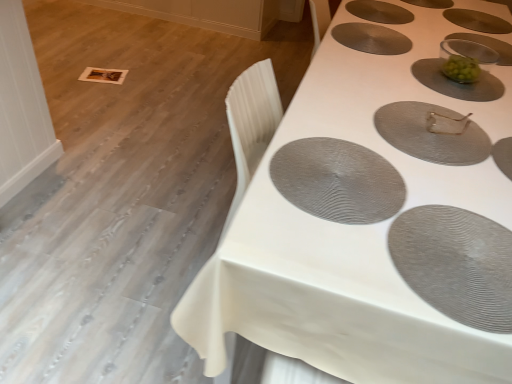
Find the location of a particular element. vacant region under textured gray oval at center, the 6th oval in the back-to-front sequence (from a real-world perspective) is located at coordinates (331, 181).